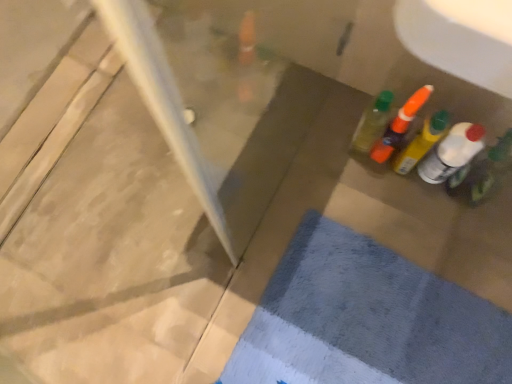
Question: From a real-world perspective, relative to blue textured bath mat at lower right, is translucent plastic bottle at right, which ranks as the first bottle in right-to-left order, vertically above or below?

Choices:
 (A) below
 (B) above

Answer: (B)

Question: Considering the positions of translucent plastic bottle at right, which ranks as the first bottle in right-to-left order, and blue textured bath mat at lower right in the image, is translucent plastic bottle at right, which ranks as the first bottle in right-to-left order, taller or shorter than blue textured bath mat at lower right?

Choices:
 (A) tall
 (B) short

Answer: (A)

Question: Estimate the real-world distances between objects in this image. Which object is farther from the translucent plastic bottle at right, acting as the first bottle starting from the left?

Choices:
 (A) translucent plastic bottle at right, the fourth bottle positioned from the left
 (B) translucent orange bottle at upper right, the second bottle when ordered from left to right
 (C) translucent plastic bottle at right, the third bottle in the left-to-right sequence
 (D) blue textured bath mat at lower right

Answer: (D)

Question: Which object is the farthest from the translucent orange bottle at upper right, the 3th bottle when ordered from right to left?

Choices:
 (A) translucent plastic bottle at right, the third bottle in the left-to-right sequence
 (B) translucent plastic bottle at right, which ranks as the first bottle in right-to-left order
 (C) blue textured bath mat at lower right
 (D) translucent plastic bottle at right, arranged as the 4th bottle when viewed from the right

Answer: (C)